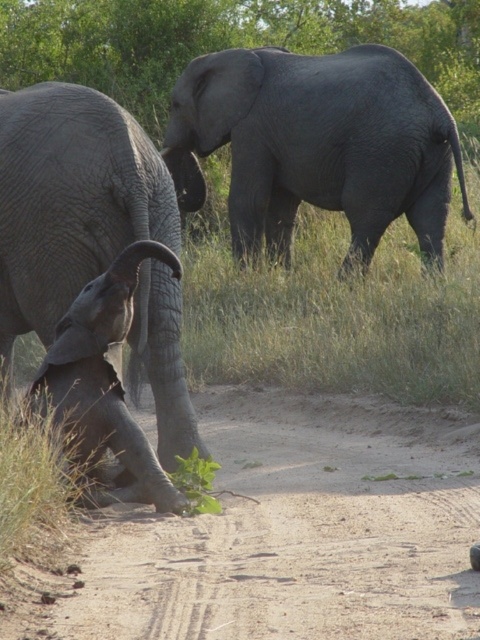
You are standing at point (x=17, y=154) and want to walk to point (x=297, y=166). Will you be moving towards the background or the foreground?

You will be moving towards the background because point (x=297, y=166) is behind point (x=17, y=154).

You are a wildlife photographer trying to capture a photo of the gray matte elephant at upper center and the gray wrinkled baby elephant at lower left. If your camera can only focus on one elephant at a time, which elephant should you adjust your focus settings for to ensure it is in sharp focus?

The gray wrinkled baby elephant at lower left is in the foreground and closer to the viewer, so adjusting focus settings for it will ensure it is in sharp focus while the gray matte elephant at upper center may appear slightly out of focus in the background.

You are a wildlife photographer trying to capture a photo of both the gray matte elephant at upper center and the gray textured elephant at left. You want to ensure that both elephants are fully visible in your shot. Based on their positions and sizes, which elephant might require you to adjust your camera angle to accommodate its width?

The gray matte elephant at upper center might be wider than the gray textured elephant at left, so you may need to adjust your camera angle to ensure it fits into the frame.